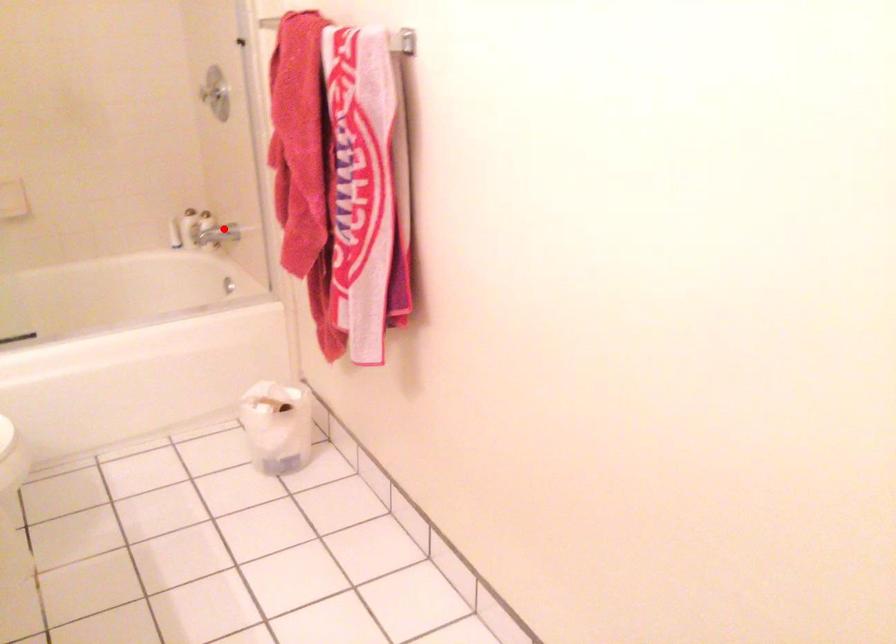
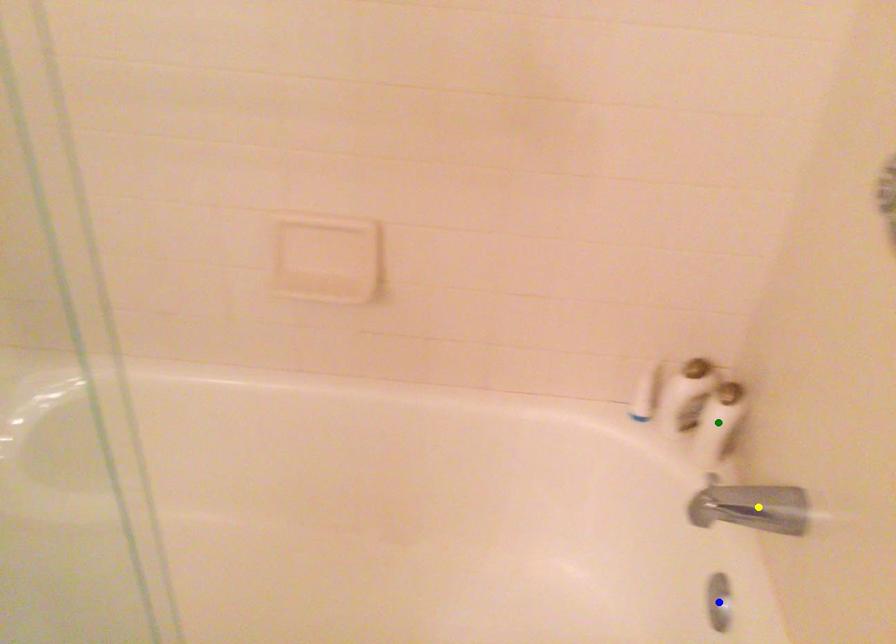
Question: I am providing you with two images of the same scene from different viewpoints. A red point is marked on the first image. You are given multiple points on the second image. Which spot in image 2 lines up with the point in image 1?

Choices:
 (A) yellow point
 (B) blue point
 (C) green point

Answer: (A)